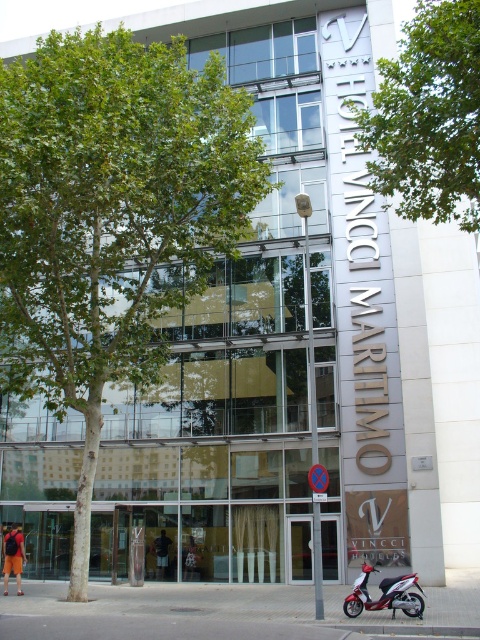
You are standing at the entrance of VINCCI HOTEL MARITIMO and want to take a photo of the building without any obstructions. The green leafy tree at upper center and the metallic red scooter at lower right are in your way. Which object should you move to get an unobstructed view?

The green leafy tree at upper center is much taller than the metallic red scooter at lower right, so you should move the green leafy tree at upper center to get an unobstructed view.

You are a delivery person trying to park your scooter near the VINCCI HOTEL MARITIMO entrance. The hotel has a tree in front of it. If you want to park your scooter so that it doesn t block the view of the hotel s name displayed on the building, where should you position it relative to the green leafy tree at center and the metallic red scooter at lower right?

Since the green leafy tree at center is taller than the metallic red scooter at lower right, you should park your scooter near the position of the metallic red scooter at lower right at lower right. This way, the shorter scooter won t block the view of the hotel s name, which is displayed vertically on the building s side.